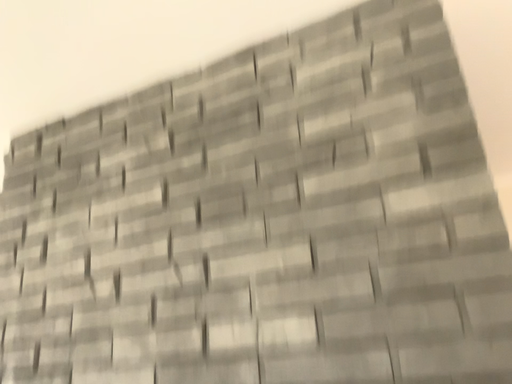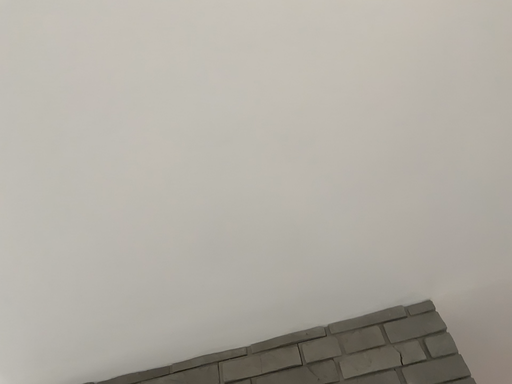
Question: Which way did the camera rotate in the video?

Choices:
 (A) rotated right
 (B) rotated left

Answer: (A)